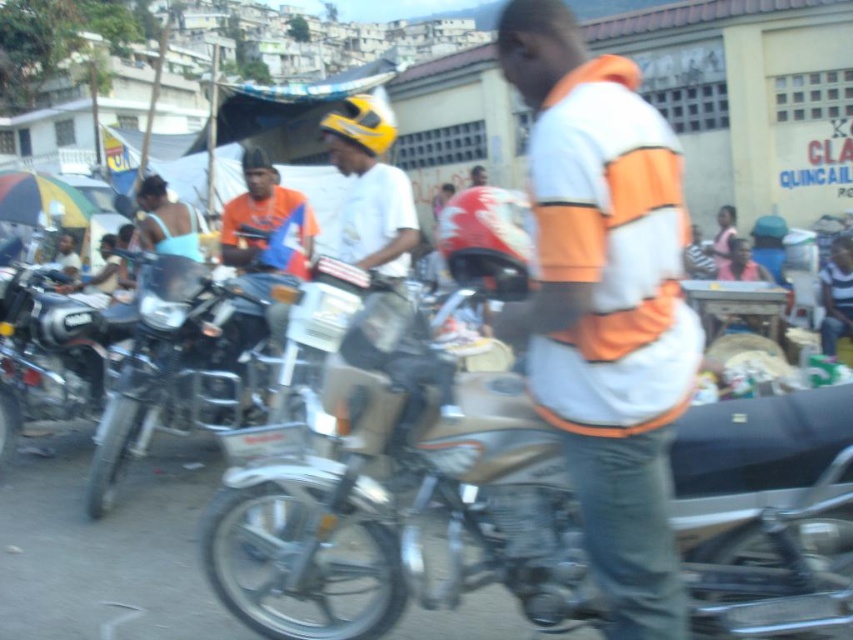
Question: Can you confirm if matte white helmet at center is positioned to the right of orange fabric shirt at center?

Choices:
 (A) yes
 (B) no

Answer: (A)

Question: Does metallic silver motorcycle at left appear on the left side of shiny chrome motorcycle at left?

Choices:
 (A) yes
 (B) no

Answer: (B)

Question: Which object appears closest to the camera in this image?

Choices:
 (A) metallic silver motorcycle at left
 (B) matte white helmet at center
 (C) white-orange jacket at center

Answer: (C)

Question: Among these points, which one is nearest to the camera?

Choices:
 (A) (531, 26)
 (B) (450, 396)
 (C) (299, 282)
 (D) (21, 288)

Answer: (B)

Question: Which object appears closest to the camera in this image?

Choices:
 (A) orange fabric shirt at center
 (B) shiny chrome motorcycle at left

Answer: (A)

Question: Does shiny chrome motorcycle at left appear under orange fabric shirt at center?

Choices:
 (A) no
 (B) yes

Answer: (B)